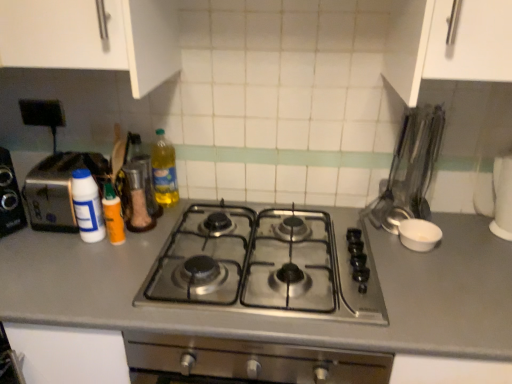
Where is `free space in front of white matte bowl at right, which is the 2th appliance from top to bottom`? This screenshot has height=384, width=512. free space in front of white matte bowl at right, which is the 2th appliance from top to bottom is located at coordinates (436, 277).